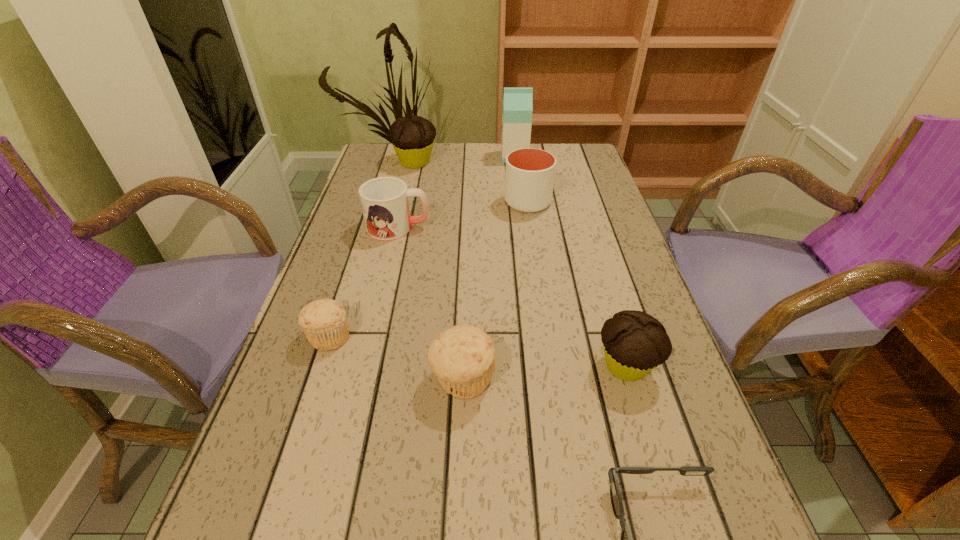
Identify the location of white milk carton. Image resolution: width=960 pixels, height=540 pixels. (517, 110).

The image size is (960, 540). I want to click on milk carton, so click(x=517, y=110).

This screenshot has height=540, width=960. What are the coordinates of `the farther chocolate muffin` in the screenshot? It's located at (412, 138).

You are a GUI agent. You are given a task and a screenshot of the screen. Output one action in this format:
    pyautogui.click(x=<x>, y=<y>)
    Task: Click on the bigger chocolate muffin
    This screenshot has height=540, width=960.
    Given the screenshot: What is the action you would take?
    pyautogui.click(x=412, y=138)

This screenshot has width=960, height=540. Find the location of `white cup`. white cup is located at coordinates (529, 176).

Locate an element on the screen. The image size is (960, 540). mug is located at coordinates (384, 200).

This screenshot has height=540, width=960. I want to click on the right beige muffin, so click(463, 357).

Locate an element on the screen. the third muffin from left to right is located at coordinates (463, 357).

Identify the location of the right chocolate muffin. (634, 342).

This screenshot has height=540, width=960. What are the coordinates of `the rightmost muffin` in the screenshot? It's located at (634, 342).